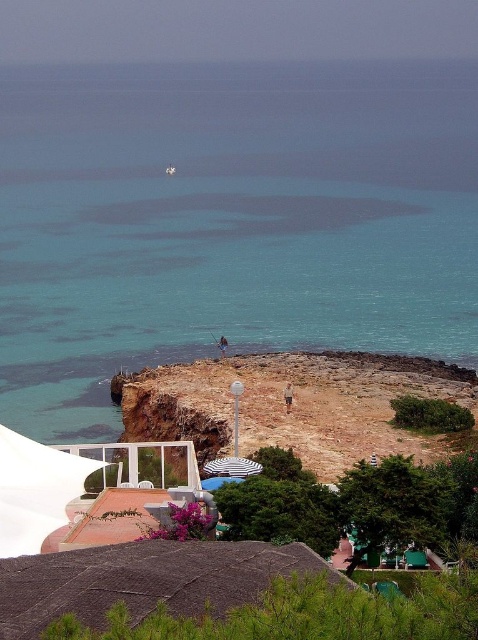
Question: Among these objects, which one is farthest from the camera?

Choices:
 (A) white fabric canopy at lower left
 (B) white striped umbrella at center
 (C) white sand beach at lower center

Answer: (C)

Question: Among these points, which one is nearest to the camera?

Choices:
 (A) (261, 426)
 (B) (245, 458)
 (C) (47, 532)
 (D) (93, 273)

Answer: (C)

Question: Is white fabric canopy at lower left bigger than white striped umbrella at lower center?

Choices:
 (A) no
 (B) yes

Answer: (B)

Question: Where is clear blue water at center located in relation to white fabric canopy at lower left in the image?

Choices:
 (A) above
 (B) below

Answer: (A)

Question: Which point is closer to the camera taking this photo?

Choices:
 (A) (282, 195)
 (B) (350, 449)
 (C) (239, 481)

Answer: (C)

Question: Is clear blue water at center bigger than white fabric canopy at lower left?

Choices:
 (A) yes
 (B) no

Answer: (A)